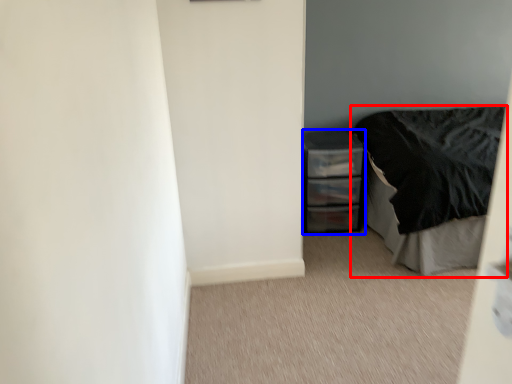
Question: Which of the following is the closest to the observer, bed (highlighted by a red box) or chest of drawers (highlighted by a blue box)?

Choices:
 (A) bed
 (B) chest of drawers

Answer: (A)